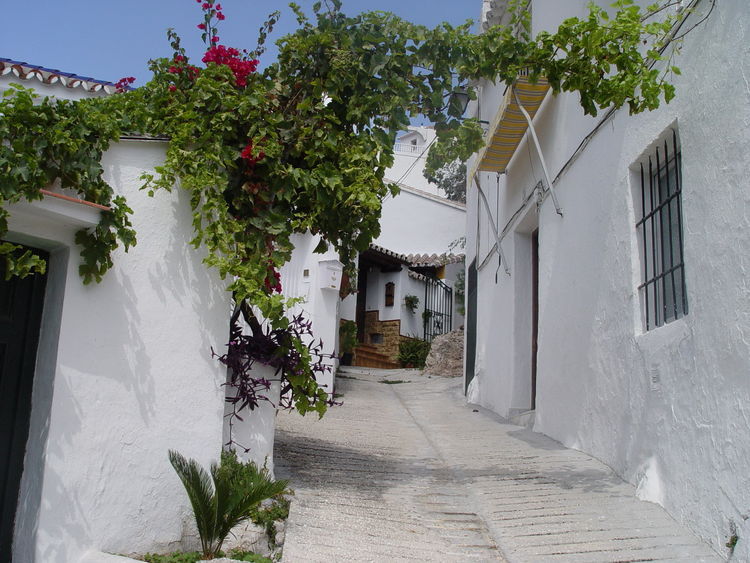
At what (x,y) coordinates should I click in order to perform the action: click on white wall. Please return your answer as a coordinate pair (x, y). The width and height of the screenshot is (750, 563). Looking at the image, I should click on (153, 350).